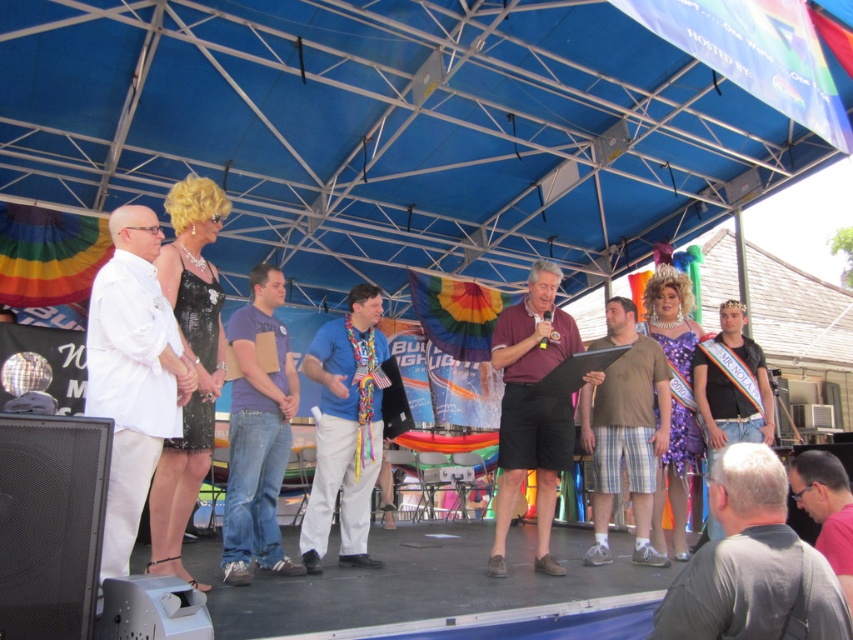
You are standing at the center of the stage and want to hand a microphone to the white matte shirt at left. Which direction should you move to reach them?

The white matte shirt at left is located at point (132, 374), so you should move to the left to reach them.

You are taking a photo of the event and want to focus on both the point at coordinates point (712, 544) and point (314, 353). Which point should you adjust your focus on first to ensure both are in clear view?

Point (712, 544) is closer to the camera than point (314, 353), so you should focus on point (712, 544) first to ensure both points are in clear view.

You are an event planner looking at the stage setup. You need to determine the spatial arrangement between the purple cotton shirt at center and the pink fabric at lower right. Based on the scene, which object is positioned higher relative to the other?

The purple cotton shirt at center is above the pink fabric at lower right.